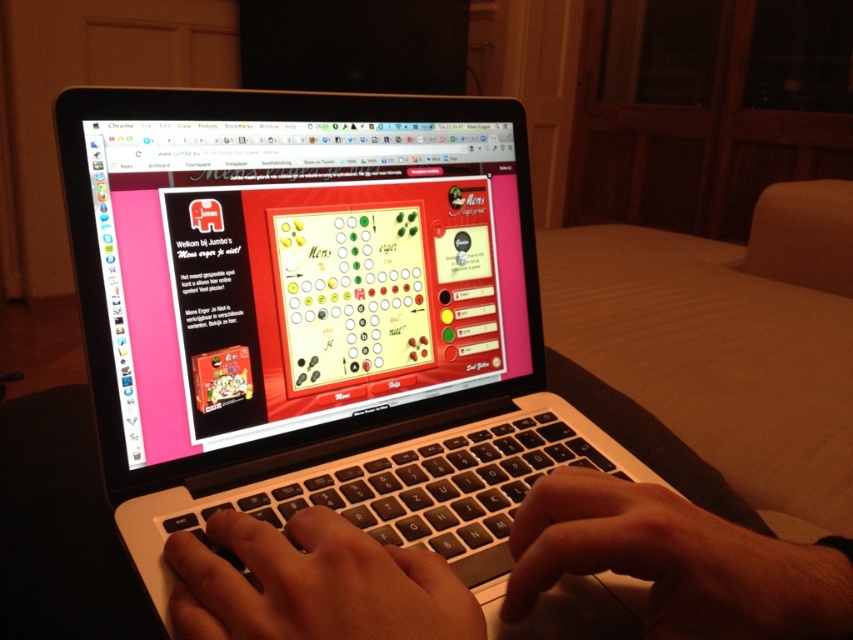
Question: Does white plastic keyboard at center have a greater width compared to black matte hand at center?

Choices:
 (A) no
 (B) yes

Answer: (B)

Question: Considering the real-world distances, which object is farthest from the dark skin hand at lower center?

Choices:
 (A) white plastic keyboard at center
 (B) silver/black laptop at center

Answer: (B)

Question: Which point appears farthest from the camera in this image?

Choices:
 (A) (647, 515)
 (B) (265, 547)
 (C) (437, 403)

Answer: (C)

Question: Among these objects, which one is nearest to the camera?

Choices:
 (A) white plastic keyboard at center
 (B) dark skin hand at lower center

Answer: (B)

Question: Does silver/black laptop at center have a smaller size compared to dark skin hand at lower center?

Choices:
 (A) no
 (B) yes

Answer: (A)

Question: Is dark skin hand at lower center thinner than white plastic keyboard at center?

Choices:
 (A) no
 (B) yes

Answer: (B)